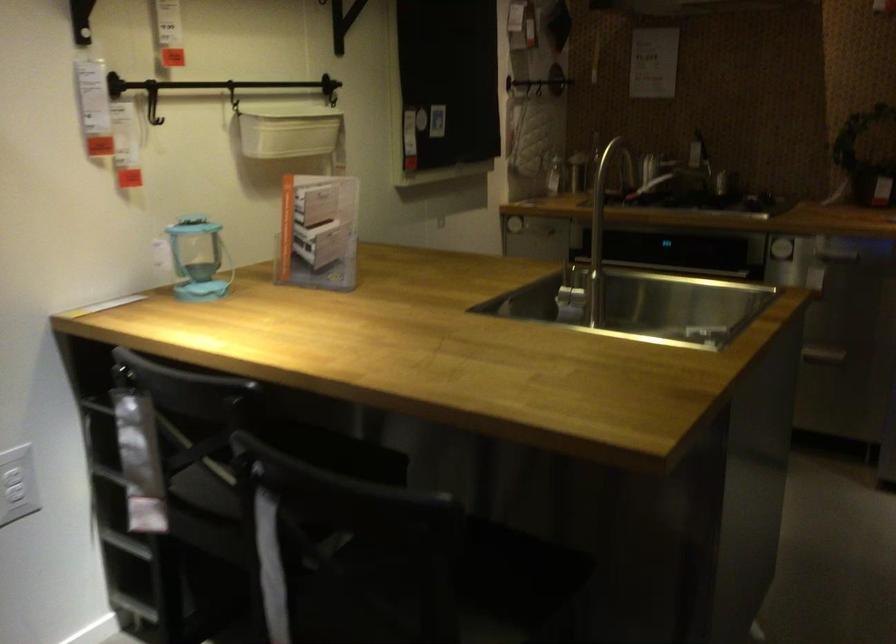
The height and width of the screenshot is (644, 896). Describe the element at coordinates (444, 590) in the screenshot. I see `the chair sitting surface` at that location.